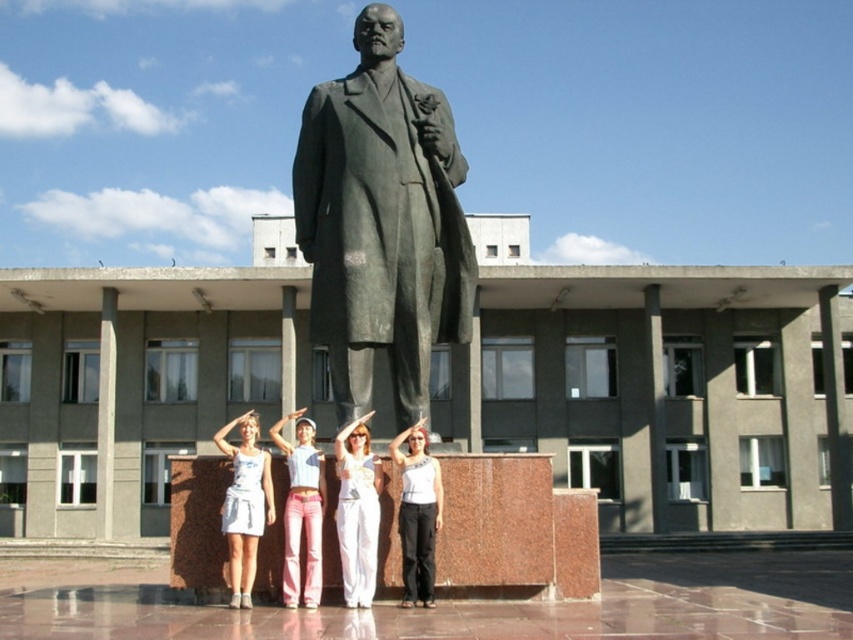
You are a photographer taking a picture of the bronze statue at center. You notice a point marked at coordinates (381, 224). Where is this point located in relation to the statue?

The point at coordinates (381, 224) is located on the bronze statue at center.

You are a photographer trying to capture a photo of the bronze statue at center without the pink denim jeans at center appearing in the frame. Given that the statue is 3.89 meters away from the jeans, what is the minimum distance you need to move backward from the current position to ensure the jeans are out of the shot?

To ensure the pink denim jeans at center are out of the frame, you need to move backward until the statue is at least 3.89 meters away from the jeans. Since they are currently 3.89 meters apart, moving backward won not change their relative distance. Therefore, adjusting the camera angle or zoom might be necessary instead of moving backward.

You are a photographer standing in front of the bronze statue at center and the white cotton tank top at center. You want to take a photo that includes both subjects. Which one should you focus on first to ensure both are in sharp focus?

You should focus on the bronze statue at center first because it is closer to you than the white cotton tank top at center, so focusing on the closer subject will help keep both in focus.